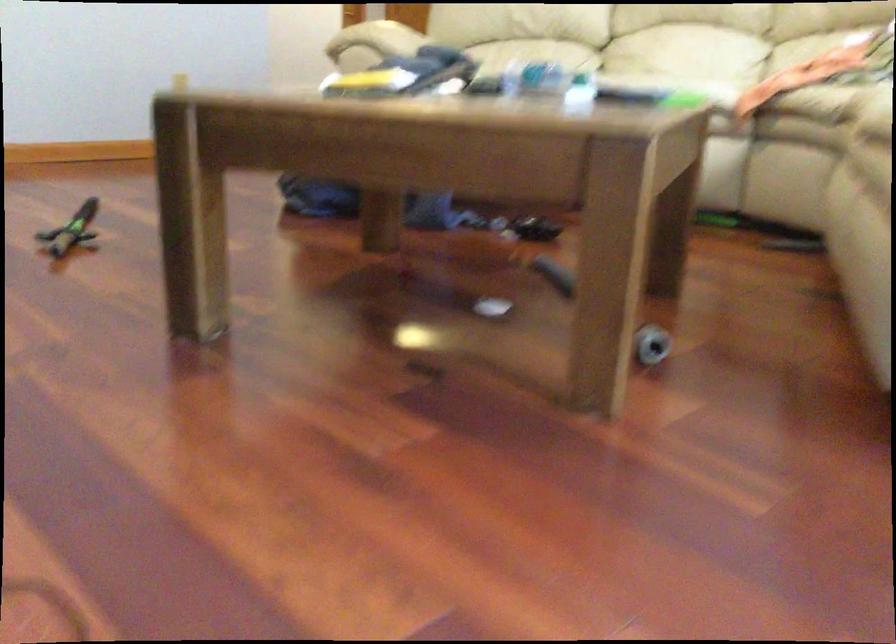
Find where to sit the sofa sitting surface. Please return your answer as a coordinate pair (x, y).

(686, 59)